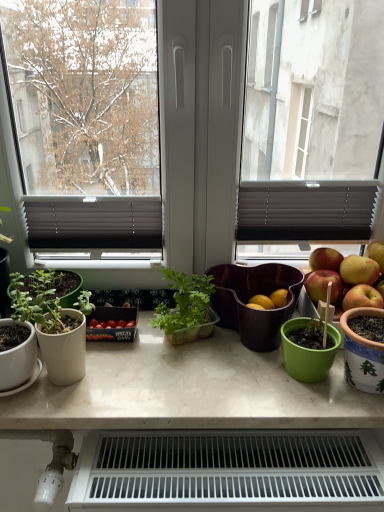
Identify the location of vacant area to the right of matte white pot at left, which is the 2th houseplant from right to left. (144, 379).